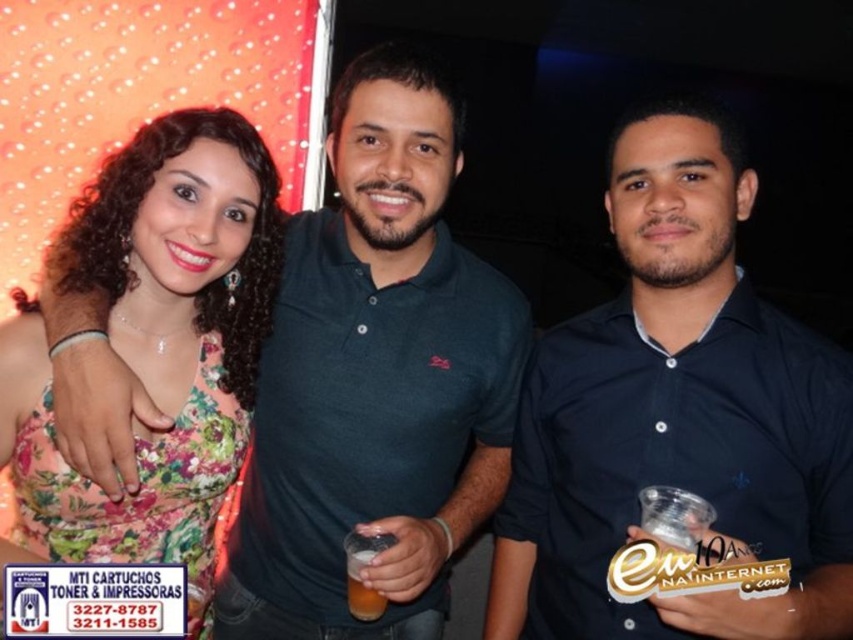
Who is positioned more to the right, floral fabric dress at center or translucent plastic cup at center?

Positioned to the right is translucent plastic cup at center.

Does floral fabric dress at center have a larger size compared to translucent plastic cup at center?

Indeed, floral fabric dress at center has a larger size compared to translucent plastic cup at center.

Is point (172, 292) positioned in front of point (349, 552)?

That is False.

Image resolution: width=853 pixels, height=640 pixels. In order to click on floral fabric dress at center in this screenshot , I will do `click(155, 340)`.

Does dark green polo shirt at center appear over translucent plastic cup at center?

Yes.

Does dark green polo shirt at center have a lesser height compared to translucent plastic cup at center?

No.

Locate an element on the screen. The height and width of the screenshot is (640, 853). dark green polo shirt at center is located at coordinates (376, 376).

Between dark blue polo shirt at center and dark green polo shirt at center, which one has more height?

With more height is dark green polo shirt at center.

Which is more to the right, dark blue polo shirt at center or dark green polo shirt at center?

From the viewer's perspective, dark blue polo shirt at center appears more on the right side.

Does point (712, 406) come in front of point (437, 250)?

That is True.

The height and width of the screenshot is (640, 853). I want to click on dark blue polo shirt at center, so point(677,413).